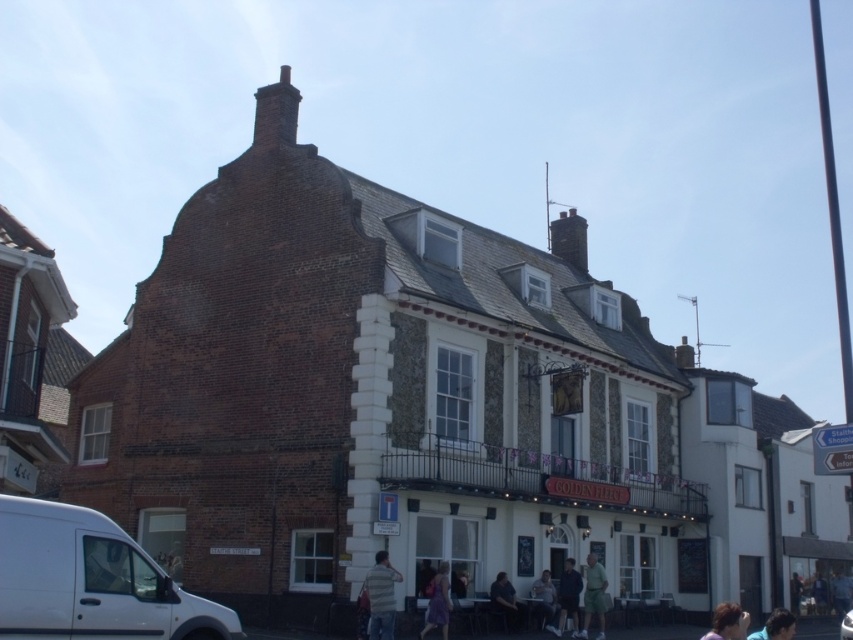
Measure the distance from green cotton shorts at lower center to light blue shirt at lower center.

green cotton shorts at lower center is 3.06 meters from light blue shirt at lower center.

Between point (584, 624) and point (550, 609), which one is positioned in front?

Point (550, 609) is more forward.

Image resolution: width=853 pixels, height=640 pixels. In order to click on green cotton shorts at lower center in this screenshot , I will do pos(593,595).

From the picture: Does green cotton shorts at lower center have a smaller size compared to blue fabric headscarf at lower right?

Indeed, green cotton shorts at lower center has a smaller size compared to blue fabric headscarf at lower right.

Is green cotton shorts at lower center to the right of blue fabric headscarf at lower right from the viewer's perspective?

No, green cotton shorts at lower center is not to the right of blue fabric headscarf at lower right.

This screenshot has height=640, width=853. Describe the element at coordinates (593, 595) in the screenshot. I see `green cotton shorts at lower center` at that location.

Locate an element on the screen. green cotton shorts at lower center is located at coordinates (593, 595).

Consider the image. Does dark blue jeans at lower center have a greater width compared to light blue jeans at lower right?

Indeed, dark blue jeans at lower center has a greater width compared to light blue jeans at lower right.

Based on the photo, who is positioned more to the left, dark blue jeans at lower center or light blue jeans at lower right?

Positioned to the left is dark blue jeans at lower center.

Is point (566, 596) farther from viewer compared to point (791, 611)?

No, it is not.

Locate an element on the screen. dark blue jeans at lower center is located at coordinates (567, 596).